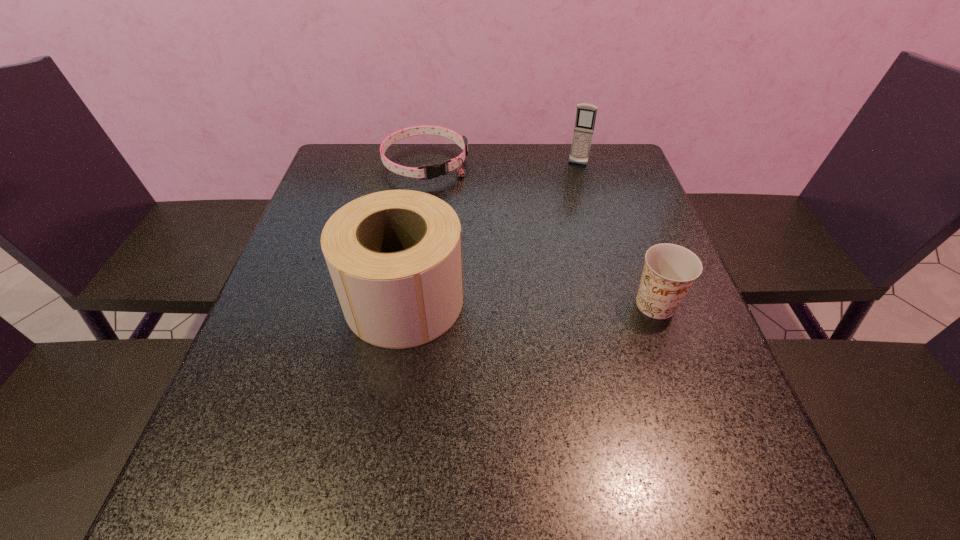
Find the location of a particular element. toilet tissue is located at coordinates (395, 257).

This screenshot has width=960, height=540. What are the coordinates of `Dixie cup` in the screenshot? It's located at (670, 270).

You are a GUI agent. You are given a task and a screenshot of the screen. Output one action in this format:
    pyautogui.click(x=<x>, y=<y>)
    Task: Click on the cellular telephone
    This screenshot has height=540, width=960.
    Given the screenshot: What is the action you would take?
    pyautogui.click(x=586, y=114)

Locate an element on the screen. This screenshot has height=540, width=960. dog collar is located at coordinates (435, 170).

At what (x,y) coordinates should I click in order to perform the action: click on free point located 0.060m on the front of the toilet tissue. Please return your answer as a coordinate pair (x, y). The height and width of the screenshot is (540, 960). Looking at the image, I should click on pos(393,376).

What are the coordinates of `free space located on the back of the second shortest object` in the screenshot? It's located at (642, 267).

I want to click on vacant space located on the front-facing side of the cellular telephone, so click(566, 190).

Where is `free location located on the front-facing side of the cellular telephone`? This screenshot has height=540, width=960. free location located on the front-facing side of the cellular telephone is located at coordinates (571, 179).

I want to click on vacant region located 0.070m on the front-facing side of the cellular telephone, so click(x=570, y=180).

Find the location of a particular element. This screenshot has width=960, height=540. vacant region located with the buckle on the shortest object is located at coordinates (451, 201).